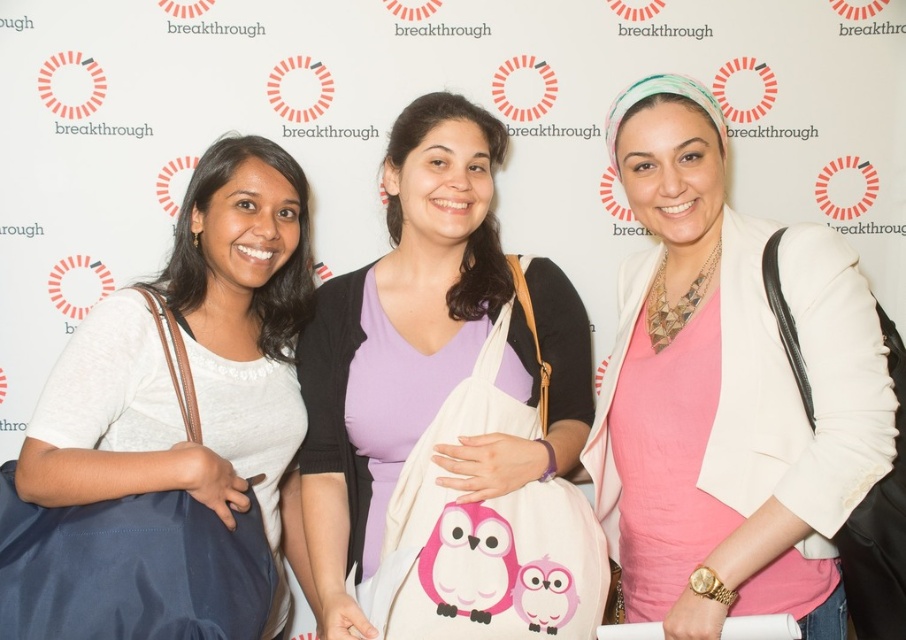
Question: Considering the real-world distances, which object is farthest from the pink fabric bag at center?

Choices:
 (A) matte white bag at left
 (B) black leather bag at right

Answer: (B)

Question: Can you confirm if pink matte shirt at center is positioned below matte white bag at left?

Choices:
 (A) yes
 (B) no

Answer: (B)

Question: Which of these objects is positioned farthest from the pink matte shirt at center?

Choices:
 (A) black leather bag at right
 (B) pink fabric bag at center

Answer: (B)

Question: Is matte white bag at left above black leather bag at right?

Choices:
 (A) yes
 (B) no

Answer: (A)

Question: Which of the following is the closest to the observer?

Choices:
 (A) [x=439, y=456]
 (B) [x=879, y=550]
 (C) [x=721, y=257]

Answer: (B)

Question: Can you confirm if pink matte shirt at center is smaller than black leather bag at right?

Choices:
 (A) yes
 (B) no

Answer: (B)